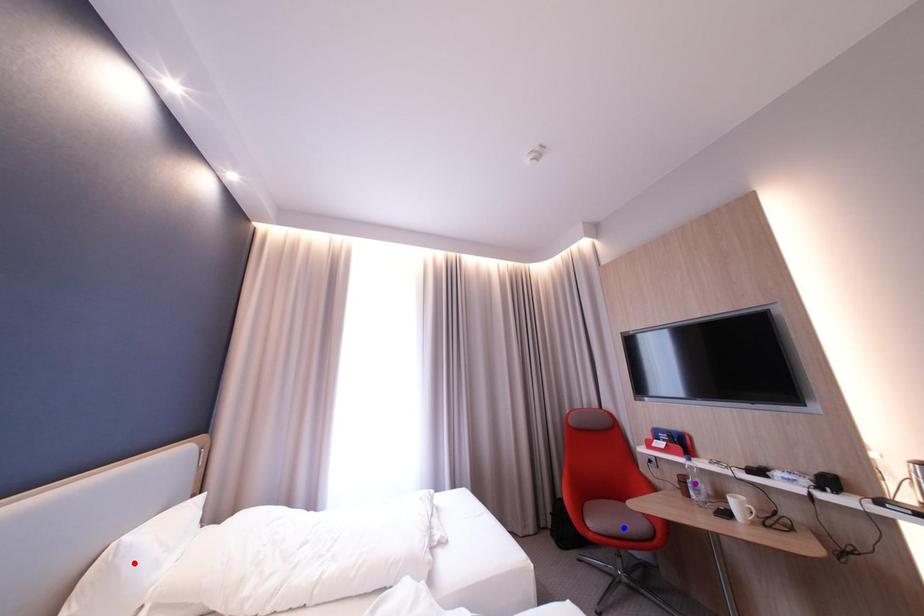
Order these from nearest to farthest:
red point, purple point, blue point

blue point
purple point
red point